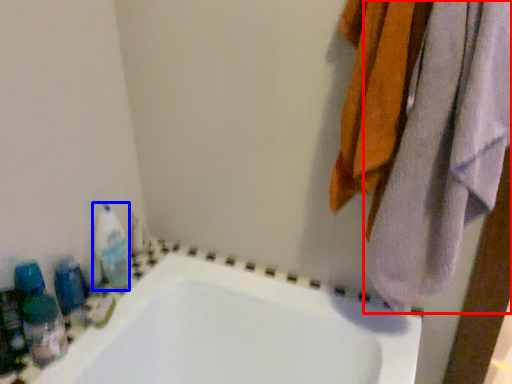
Question: Which point is further to the camera, towel (highlighted by a red box) or cleaning product (highlighted by a blue box)?

Choices:
 (A) towel
 (B) cleaning product

Answer: (B)